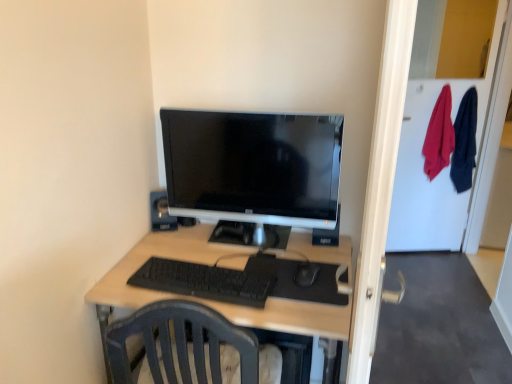
This screenshot has width=512, height=384. In order to click on spots to the right of black matte keyboard at center in this screenshot , I will do `click(304, 288)`.